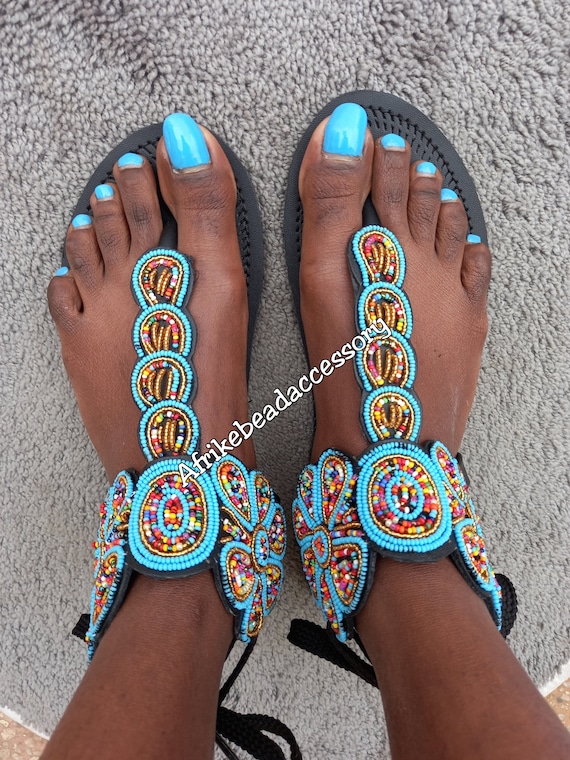
Find the location of a particular element. Image resolution: width=570 pixels, height=760 pixels. gray carpet is located at coordinates (241, 54), (461, 61).